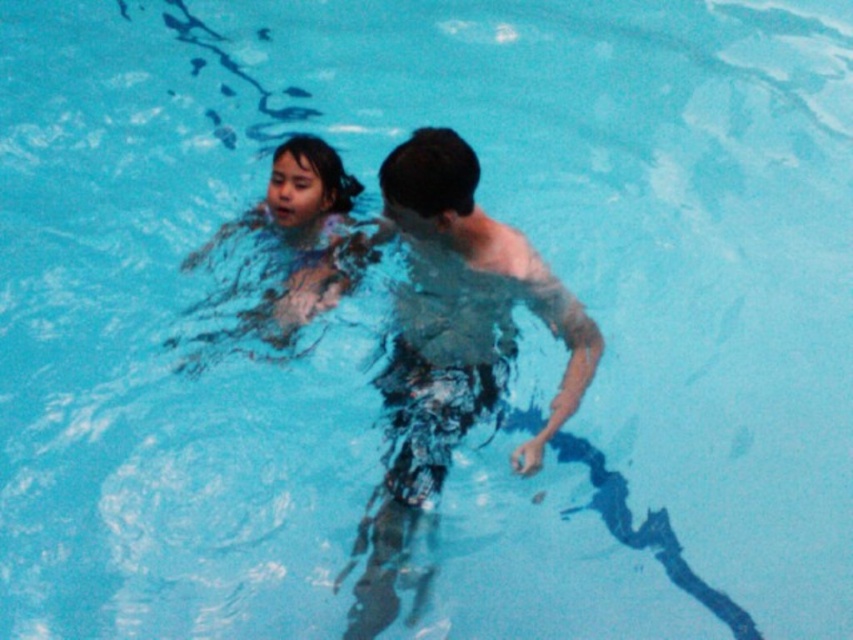
Question: Which point is farther to the camera?

Choices:
 (A) smooth skin child at center
 (B) translucent wet hair at upper center

Answer: (A)

Question: Is translucent wet hair at upper center thinner than smooth skin child at center?

Choices:
 (A) yes
 (B) no

Answer: (B)

Question: Observing the image, what is the correct spatial positioning of translucent wet hair at upper center in reference to smooth skin child at center?

Choices:
 (A) above
 (B) below

Answer: (B)

Question: Which of the following is the closest to the observer?

Choices:
 (A) (498, 388)
 (B) (315, 289)

Answer: (A)

Question: Does translucent wet hair at upper center have a greater width compared to smooth skin child at center?

Choices:
 (A) yes
 (B) no

Answer: (A)